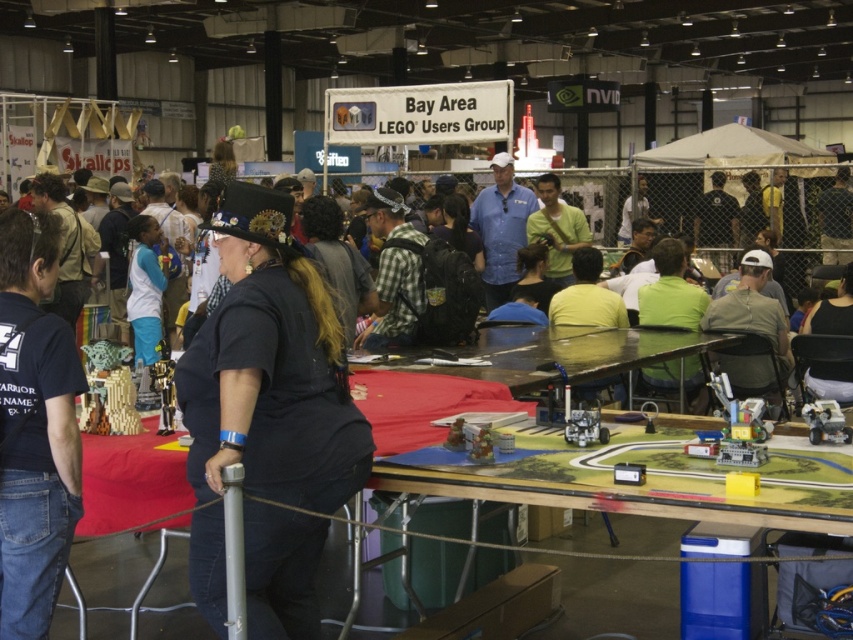
You are attending a LEGO convention and notice two attendees wearing the black matte vest at center and the gray fabric shirt at right. From your perspective at the entrance, which one is positioned more to the left?

The black matte vest at center is positioned more to the left than the gray fabric shirt at right.

You are attending the LEGO convention and notice two attendees wearing the black matte vest at center and the gray fabric shirt at right. From your perspective at the entrance, which clothing item is closer to you?

The black matte vest at center is positioned under the gray fabric shirt at right, meaning it is closer to you since it is in front.